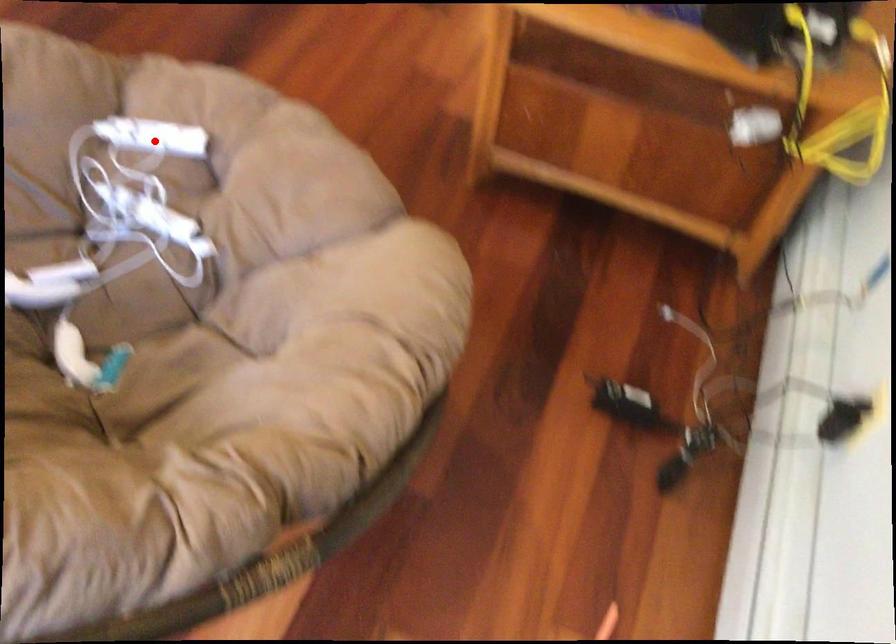
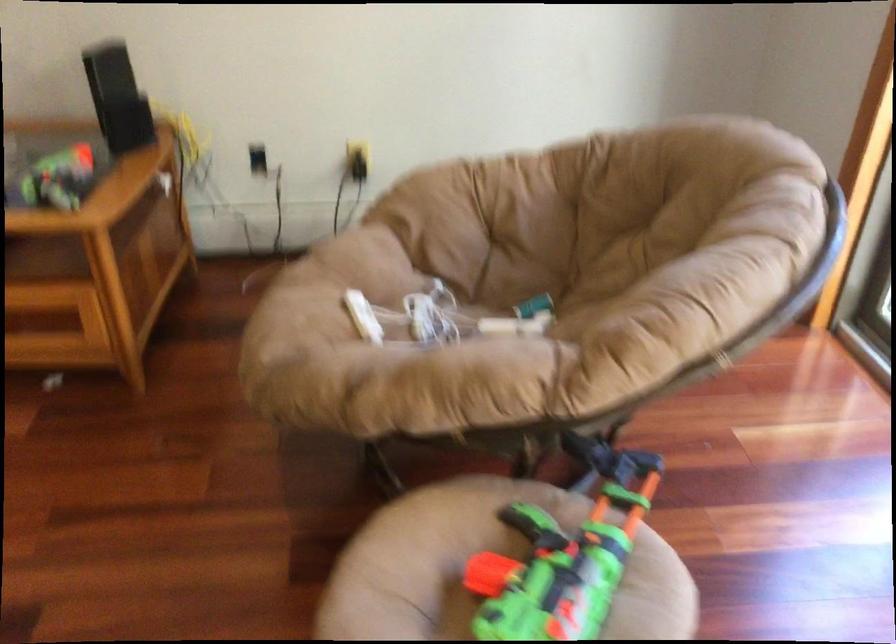
Question: I am providing you with two images of the same scene from different viewpoints. Given a red point in image1, look at the same physical point in image2. Is it:

Choices:
 (A) Closer to the viewpoint
 (B) Farther from the viewpoint

Answer: (B)